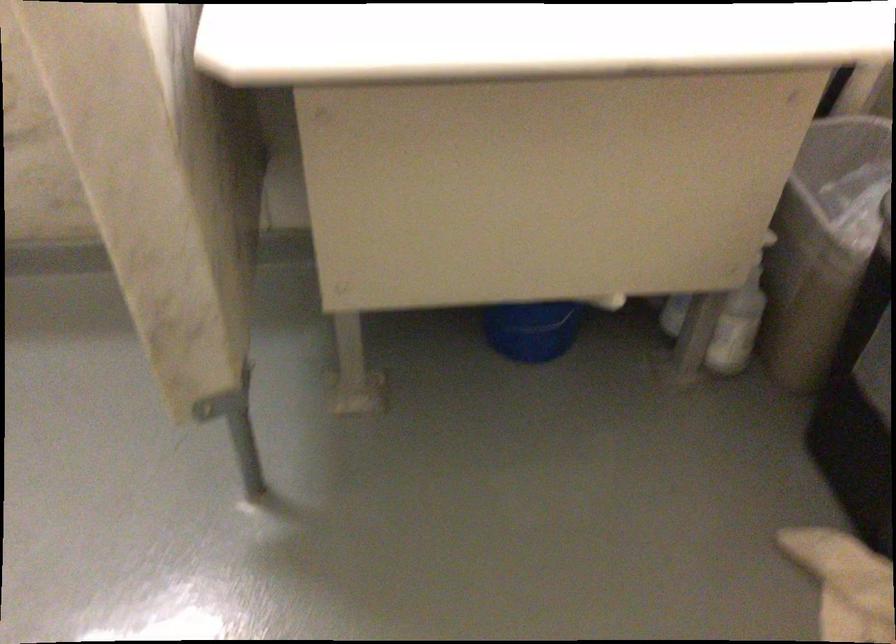
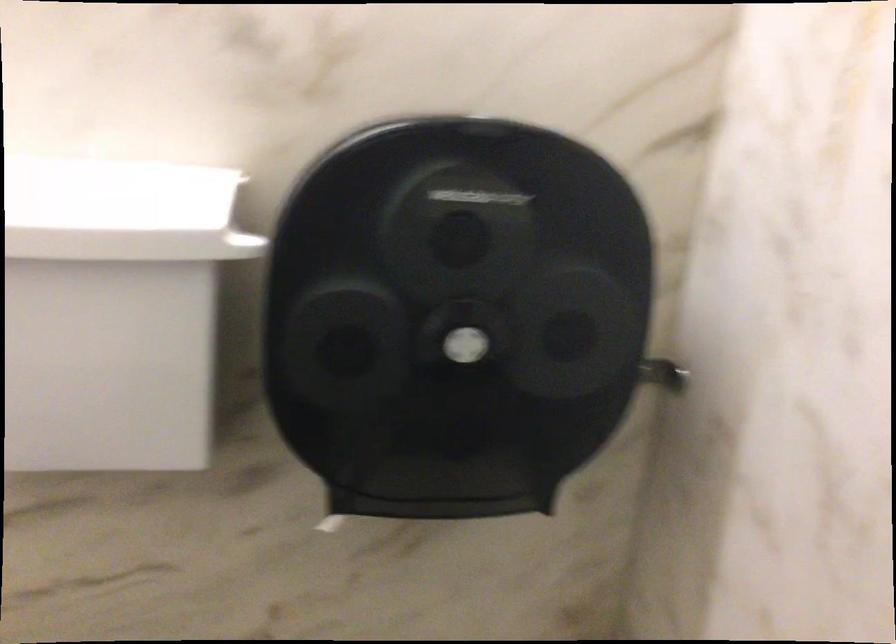
Which direction would the cameraman need to move to produce the second image?

The movement direction of the cameraman is left, forward.